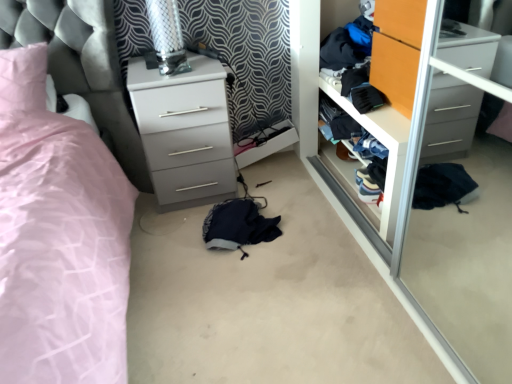
Where is `vacant position to the left of wooden closet door at center`? vacant position to the left of wooden closet door at center is located at coordinates (301, 187).